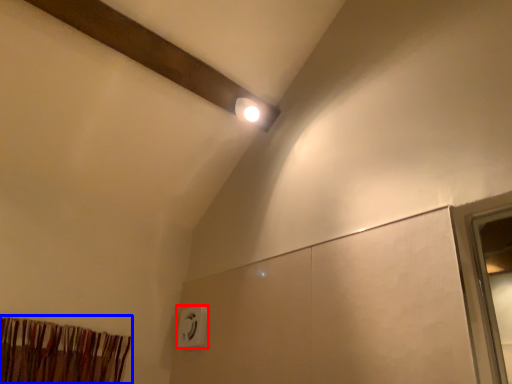
Question: Which point is further to the camera, electric outlet (highlighted by a red box) or curtain (highlighted by a blue box)?

Choices:
 (A) electric outlet
 (B) curtain

Answer: (A)